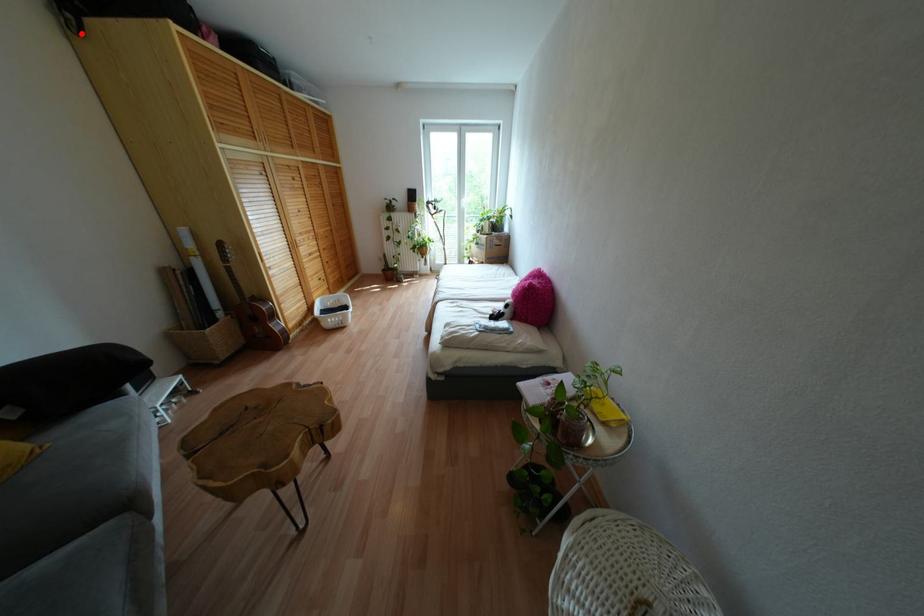
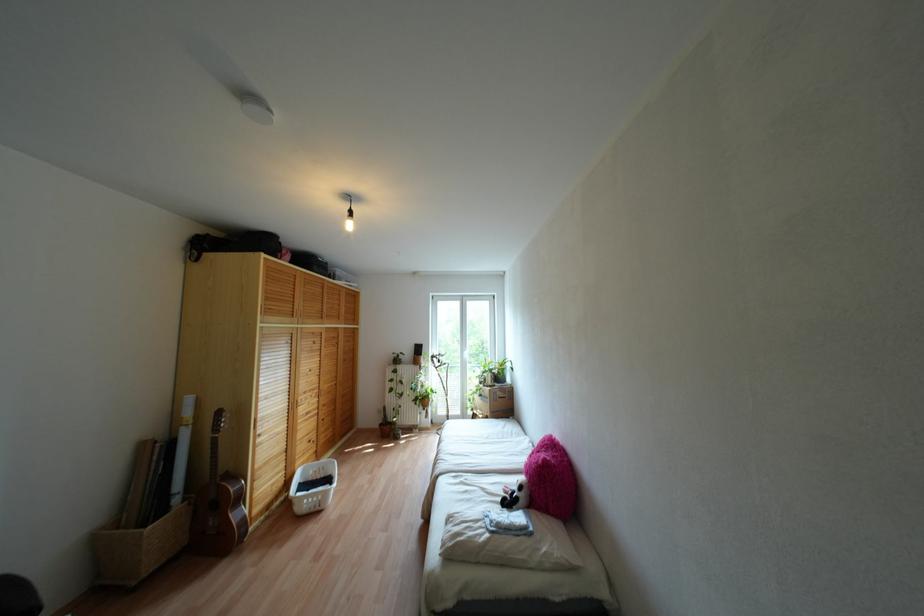
Question: I am providing you with two images of the same scene from different viewpoints. A red point is shown in image1. For the corresponding object point in image2, is it positioned nearer or farther from the camera?

Choices:
 (A) Nearer
 (B) Farther

Answer: (A)